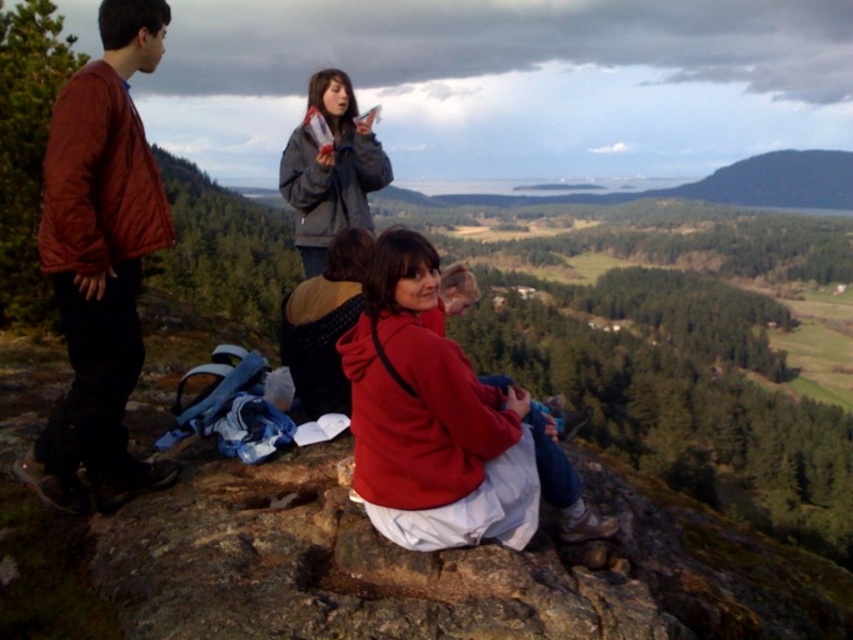
Question: Does matte brown jacket at left have a larger size compared to matte red hoodie at center?

Choices:
 (A) yes
 (B) no

Answer: (B)

Question: Where is matte red hoodie at center located in relation to gray leather jacket at upper center in the image?

Choices:
 (A) right
 (B) left

Answer: (A)

Question: Which of the following is the closest to the observer?

Choices:
 (A) (361, 145)
 (B) (451, 364)
 (C) (103, 68)

Answer: (B)

Question: Can you confirm if matte red hoodie at center is thinner than gray leather jacket at upper center?

Choices:
 (A) no
 (B) yes

Answer: (B)

Question: Considering the real-world distances, which object is farthest from the gray leather jacket at upper center?

Choices:
 (A) matte red hoodie at center
 (B) matte brown jacket at left

Answer: (B)

Question: Which object appears closest to the camera in this image?

Choices:
 (A) gray leather jacket at upper center
 (B) matte red hoodie at center

Answer: (B)